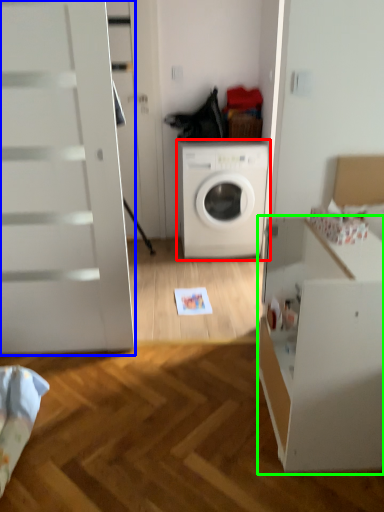
Question: Based on their relative distances, which object is nearer to washing machine (highlighted by a red box)? Choose from screen door (highlighted by a blue box) and file cabinet (highlighted by a green box).

Choices:
 (A) screen door
 (B) file cabinet

Answer: (A)